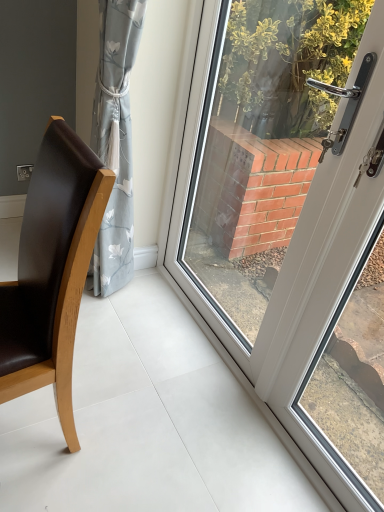
Question: From a real-world perspective, does white glossy door at center stand above brown leather chair at left?

Choices:
 (A) no
 (B) yes

Answer: (B)

Question: Can you confirm if white glossy door at center is wider than brown leather chair at left?

Choices:
 (A) yes
 (B) no

Answer: (B)

Question: Does white glossy door at center have a lesser height compared to brown leather chair at left?

Choices:
 (A) no
 (B) yes

Answer: (A)

Question: From a real-world perspective, does white glossy door at center sit lower than brown leather chair at left?

Choices:
 (A) no
 (B) yes

Answer: (A)

Question: Considering the relative positions of white glossy door at center and brown leather chair at left in the image provided, is white glossy door at center to the right of brown leather chair at left from the viewer's perspective?

Choices:
 (A) no
 (B) yes

Answer: (B)

Question: Is white glossy door at center not close to brown leather chair at left?

Choices:
 (A) yes
 (B) no

Answer: (B)

Question: From the image's perspective, is brown leather chair at left on top of white glossy door at center?

Choices:
 (A) yes
 (B) no

Answer: (B)

Question: From a real-world perspective, is brown leather chair at left physically above white glossy door at center?

Choices:
 (A) yes
 (B) no

Answer: (B)

Question: Can you confirm if brown leather chair at left is smaller than white glossy door at center?

Choices:
 (A) no
 (B) yes

Answer: (B)

Question: Considering the relative sizes of brown leather chair at left and white glossy door at center in the image provided, is brown leather chair at left shorter than white glossy door at center?

Choices:
 (A) yes
 (B) no

Answer: (A)

Question: Does brown leather chair at left lie behind white glossy door at center?

Choices:
 (A) yes
 (B) no

Answer: (A)

Question: From a real-world perspective, is brown leather chair at left physically below white glossy door at center?

Choices:
 (A) yes
 (B) no

Answer: (A)

Question: Is white glossy door at center taller or shorter than brown leather chair at left?

Choices:
 (A) short
 (B) tall

Answer: (B)